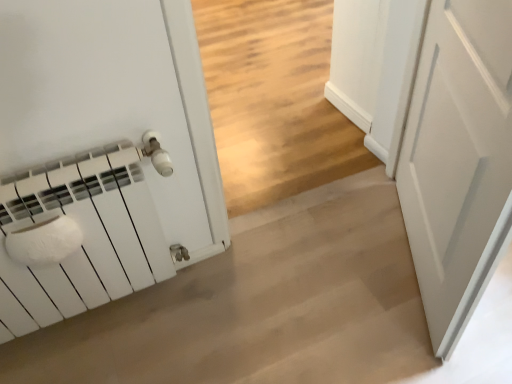
Question: Would you consider white matte radiator at left to be distant from white matte door at right?

Choices:
 (A) yes
 (B) no

Answer: (B)

Question: Can you confirm if white matte radiator at left is thinner than white matte door at right?

Choices:
 (A) yes
 (B) no

Answer: (B)

Question: Can you confirm if white matte radiator at left is bigger than white matte door at right?

Choices:
 (A) no
 (B) yes

Answer: (B)

Question: From the image's perspective, is white matte radiator at left on white matte door at right?

Choices:
 (A) no
 (B) yes

Answer: (A)

Question: From a real-world perspective, is white matte radiator at left over white matte door at right?

Choices:
 (A) yes
 (B) no

Answer: (B)

Question: Does white matte radiator at left contain white matte door at right?

Choices:
 (A) no
 (B) yes

Answer: (A)

Question: From a real-world perspective, is white matte door at right below white matte radiator at left?

Choices:
 (A) no
 (B) yes

Answer: (A)

Question: Is the position of white matte door at right less distant than that of white matte radiator at left?

Choices:
 (A) no
 (B) yes

Answer: (B)

Question: Is white matte door at right shorter than white matte radiator at left?

Choices:
 (A) yes
 (B) no

Answer: (B)

Question: From a real-world perspective, is white matte door at right on top of white matte radiator at left?

Choices:
 (A) yes
 (B) no

Answer: (A)

Question: From the image's perspective, does white matte door at right appear lower than white matte radiator at left?

Choices:
 (A) yes
 (B) no

Answer: (B)

Question: Is white matte door at right facing towards white matte radiator at left?

Choices:
 (A) yes
 (B) no

Answer: (A)

Question: In the image, is white matte door at right on the left side or the right side of white matte radiator at left?

Choices:
 (A) left
 (B) right

Answer: (B)